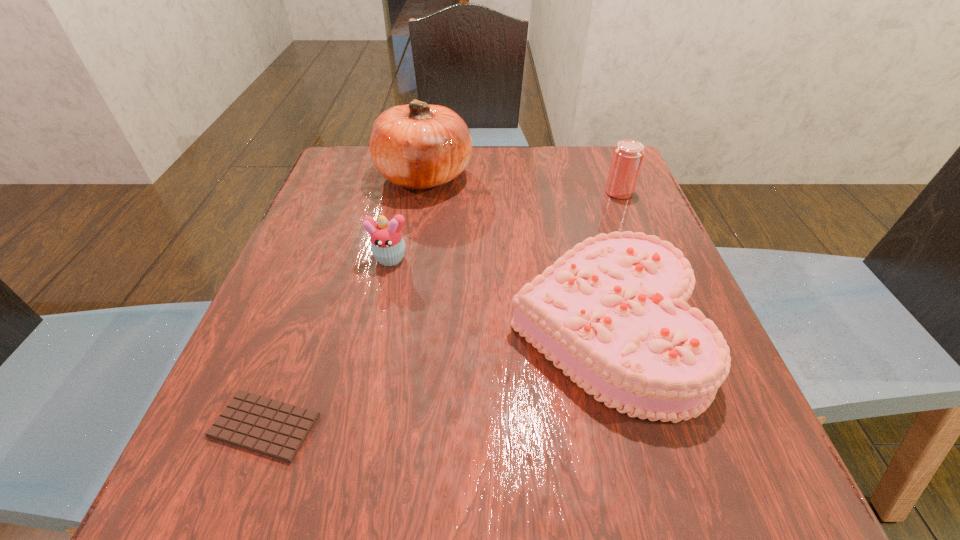
Where is `free location that satisfies the following two spatial constraints: 1. on the front side of the pumpkin; 2. on the left side of the cake`? The image size is (960, 540). free location that satisfies the following two spatial constraints: 1. on the front side of the pumpkin; 2. on the left side of the cake is located at coordinates (398, 329).

Identify the location of free location that satisfies the following two spatial constraints: 1. on the face of the cupcake; 2. on the right side of the cake. The height and width of the screenshot is (540, 960). coord(374,329).